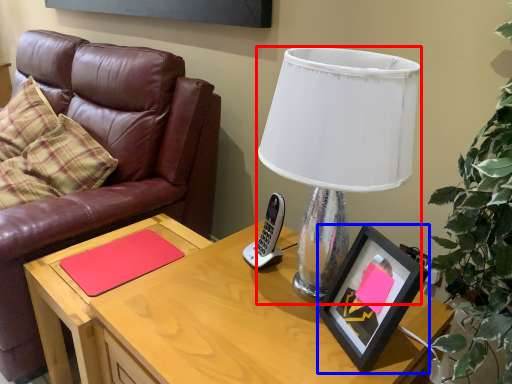
Question: Among these objects, which one is nearest to the camera, lamp (highlighted by a red box) or picture frame (highlighted by a blue box)?

Choices:
 (A) lamp
 (B) picture frame

Answer: (A)